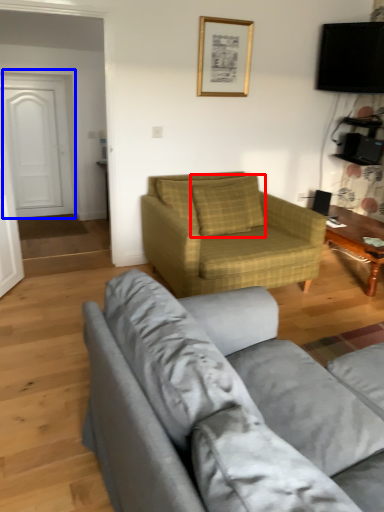
Question: Which object appears closest to the camera in this image, pillow (highlighted by a red box) or door (highlighted by a blue box)?

Choices:
 (A) pillow
 (B) door

Answer: (A)